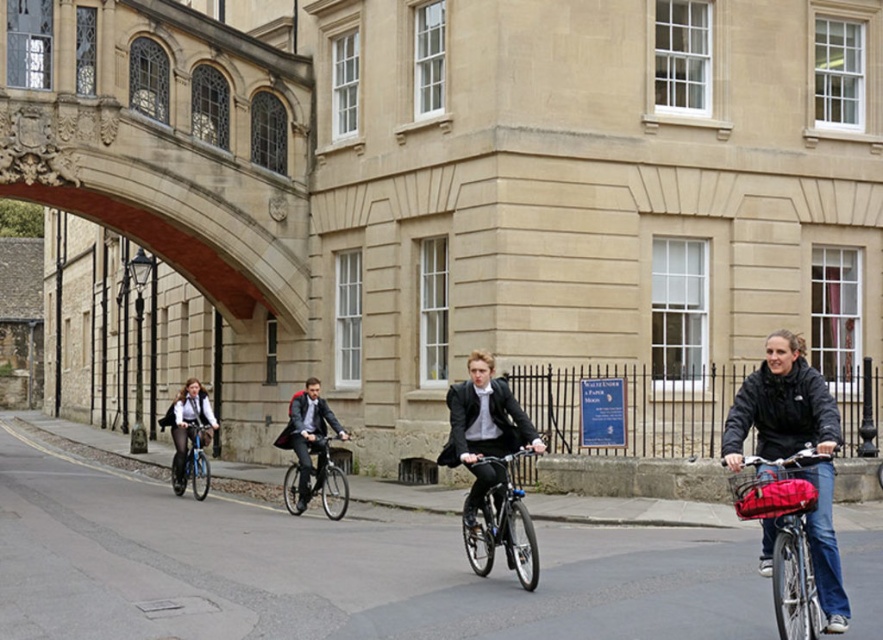
Consider the image. You are a photographer standing in front of the historic building. You notice the matte black jacket at left and the blue metallic bicycle at left. Which object is positioned higher from the ground?

The matte black jacket at left is located above the blue metallic bicycle at left, so it is higher from the ground.

In the scene shown: You are standing at the center of the street in front of the historic building. You need to move to the matte black bicycle at right. Which direction should you walk to reach it?

Since the matte black bicycle at right is located at point 0.844 on the x and 0.890 on the y, you should walk towards the right side of the street to reach it.

You are a pedestrian standing at the edge of the road in front of the historic building. You want to cross the road to reach the entrance of the building. The entrance is located between the matte black bicycle at right and the shiny blue bicycle at center. Can you safely cross between these two bicycles if the road is 10 feet wide?

The matte black bicycle at right is 9.66 feet away from the shiny blue bicycle at center. Since the road is 10 feet wide, there is enough space to safely cross between them.